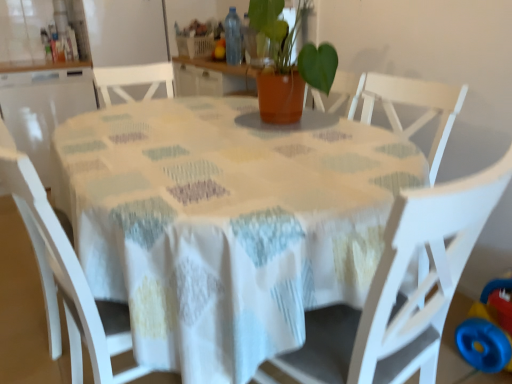
The width and height of the screenshot is (512, 384). What do you see at coordinates (399, 289) in the screenshot?
I see `white wood chair at center, which is the 2th chair from left to right` at bounding box center [399, 289].

The image size is (512, 384). What do you see at coordinates (288, 64) in the screenshot?
I see `terracotta pot at center` at bounding box center [288, 64].

The image size is (512, 384). Find the location of `white fabric table at center`. white fabric table at center is located at coordinates (226, 223).

Is white wood chair at center, which is the 2th chair from left to right, completely or partially inside terracotta pot at center?

Definitely not — white wood chair at center, which is the 2th chair from left to right, is not inside terracotta pot at center.

Considering the sizes of objects terracotta pot at center and white wood chair at center, which is the 2th chair from left to right, in the image provided, who is bigger, terracotta pot at center or white wood chair at center, which is the 2th chair from left to right,?

With larger size is white wood chair at center, which is the 2th chair from left to right.

Does terracotta pot at center have a greater height compared to white wood chair at center, which is the 2th chair from left to right?

No.

How different are the orientations of terracotta pot at center and white fabric table at center in degrees?

The facing directions of terracotta pot at center and white fabric table at center are 2.29 degrees apart.

Between point (332, 73) and point (301, 149), which one is positioned in front?

The point (301, 149) is more forward.

Find the location of a particular element. This screenshot has height=384, width=512. houseplant that is above the white fabric table at center (from a real-world perspective) is located at coordinates (288, 64).

Where is `toy lying behind the white wood chair at center, which is the 2th chair from left to right`? toy lying behind the white wood chair at center, which is the 2th chair from left to right is located at coordinates (488, 329).

Is white wood chair at center, the first chair when ordered from right to left, beside blue plastic toy at lower right?

white wood chair at center, the first chair when ordered from right to left, is not next to blue plastic toy at lower right, and they're not touching.

In the image, is white wood chair at center, the first chair when ordered from right to left, on the left side or the right side of blue plastic toy at lower right?

In the image, white wood chair at center, the first chair when ordered from right to left, appears on the left side of blue plastic toy at lower right.

Is white wood chair at center, which is the 2th chair from left to right, bigger than blue plastic toy at lower right?

Yes, white wood chair at center, which is the 2th chair from left to right, is bigger than blue plastic toy at lower right.

Looking at this image, from a real-world perspective, is white wood chair at center, which is the 2th chair from left to right, positioned under terracotta pot at center based on gravity?

Yes.

How many degrees apart are the facing directions of white wood chair at center, which is the 2th chair from left to right, and terracotta pot at center?

There is a 90-degree angle between the facing directions of white wood chair at center, which is the 2th chair from left to right, and terracotta pot at center.

Can you confirm if white wood chair at center, which is the 2th chair from left to right, is smaller than terracotta pot at center?

No.

Which is in front, white wood chair at center, the first chair when ordered from right to left, or terracotta pot at center?

white wood chair at center, the first chair when ordered from right to left, is closer to the camera.

Is point (284, 60) closer to viewer compared to point (461, 354)?

No, (284, 60) is further to viewer.

Is terracotta pot at center touching blue plastic toy at lower right?

No, terracotta pot at center is not beside blue plastic toy at lower right.

What's the angular difference between terracotta pot at center and blue plastic toy at lower right's facing directions?

They differ by 3.44 degrees in their facing directions.

Does terracotta pot at center lie behind blue plastic toy at lower right?

No, terracotta pot at center is in front of blue plastic toy at lower right.

From a real-world perspective, is white matte chair at left, acting as the first chair starting from the left, under terracotta pot at center?

Yes, from a real-world perspective, white matte chair at left, acting as the first chair starting from the left, is below terracotta pot at center.

Between white matte chair at left, acting as the first chair starting from the left, and terracotta pot at center, which one appears on the right side from the viewer's perspective?

terracotta pot at center.

In terms of size, does white matte chair at left, the second chair viewed from the right, appear bigger or smaller than terracotta pot at center?

white matte chair at left, the second chair viewed from the right, is bigger than terracotta pot at center.

Is transparent plastic bottle at center beside white matte chair at left, the second chair viewed from the right?

No.

Is transparent plastic bottle at center completely or partially outside of white matte chair at left, the second chair viewed from the right?

Yes, transparent plastic bottle at center is outside of white matte chair at left, the second chair viewed from the right.

Locate an element on the screen. The image size is (512, 384). bottle above the white matte chair at left, the second chair viewed from the right (from a real-world perspective) is located at coordinates (233, 37).

Is transparent plastic bottle at center turned away from white matte chair at left, acting as the first chair starting from the left?

transparent plastic bottle at center is not turned away from white matte chair at left, acting as the first chair starting from the left.

Where is `houseplant above the white wood chair at center, which is the 2th chair from left to right (from a real-world perspective)`? Image resolution: width=512 pixels, height=384 pixels. houseplant above the white wood chair at center, which is the 2th chair from left to right (from a real-world perspective) is located at coordinates (288, 64).

Image resolution: width=512 pixels, height=384 pixels. Identify the location of houseplant on the right of white fabric table at center. tap(288, 64).

Based on the photo, based on their spatial positions, is transparent plastic bottle at center or terracotta pot at center further from white matte chair at left, the second chair viewed from the right?

Based on the image, transparent plastic bottle at center appears to be further to white matte chair at left, the second chair viewed from the right.

When comparing their distances from blue plastic toy at lower right, does white fabric table at center or white matte chair at left, the second chair viewed from the right, seem further?

white matte chair at left, the second chair viewed from the right.

Based on their spatial positions, is white fabric table at center or transparent plastic bottle at center closer to white wood chair at center, the first chair when ordered from right to left?

Based on the image, white fabric table at center appears to be nearer to white wood chair at center, the first chair when ordered from right to left.

From the image, which object appears to be farther from transparent plastic bottle at center, terracotta pot at center or white fabric table at center?

Based on the image, white fabric table at center appears to be further to transparent plastic bottle at center.

Which object lies nearer to the anchor point white fabric table at center, terracotta pot at center or white matte chair at left, the second chair viewed from the right?

The object closer to white fabric table at center is white matte chair at left, the second chair viewed from the right.

Estimate the real-world distances between objects in this image. Which object is closer to white wood chair at center, the first chair when ordered from right to left, blue plastic toy at lower right or white fabric table at center?

white fabric table at center is closer to white wood chair at center, the first chair when ordered from right to left.

Considering their positions, is white matte chair at left, acting as the first chair starting from the left, positioned further to blue plastic toy at lower right than terracotta pot at center?

white matte chair at left, acting as the first chair starting from the left, is further to blue plastic toy at lower right.

Based on their spatial positions, is white wood chair at center, which is the 2th chair from left to right, or terracotta pot at center further from white fabric table at center?

terracotta pot at center.

Where is `houseplant situated between white matte chair at left, the second chair viewed from the right, and blue plastic toy at lower right from left to right`? houseplant situated between white matte chair at left, the second chair viewed from the right, and blue plastic toy at lower right from left to right is located at coordinates (288, 64).

The image size is (512, 384). Find the location of `houseplant between white wood chair at center, which is the 2th chair from left to right, and transparent plastic bottle at center, along the z-axis`. houseplant between white wood chair at center, which is the 2th chair from left to right, and transparent plastic bottle at center, along the z-axis is located at coordinates (288, 64).

Find the location of a particular element. chair between white wood chair at center, the first chair when ordered from right to left, and transparent plastic bottle at center from front to back is located at coordinates coord(67,279).

At what (x,y) coordinates should I click in order to perform the action: click on chair situated between white matte chair at left, the second chair viewed from the right, and blue plastic toy at lower right from left to right. Please return your answer as a coordinate pair (x, y). This screenshot has width=512, height=384. Looking at the image, I should click on (399, 289).